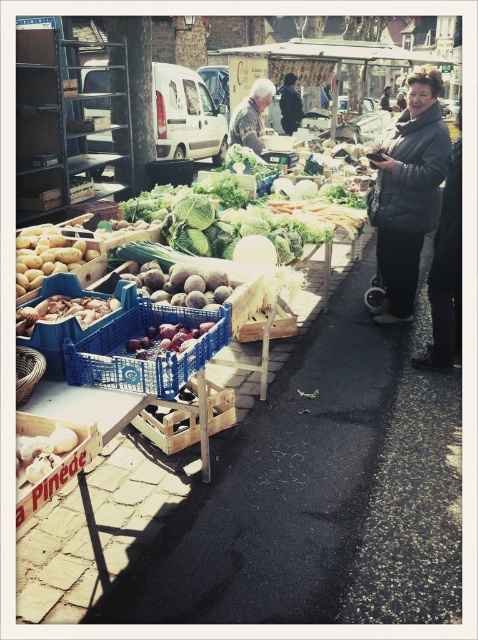
You are a customer at the market and want to find the shortest dark gray clothing item. Which one between the dark gray textured coat at right and the dark gray jacket at center should you look for?

The dark gray textured coat at right has a lesser height compared to the dark gray jacket at center, so you should look for the dark gray textured coat at right.

You are standing at the entrance of the market and want to reach the point marked as point (409, 81). Can you estimate how far you need to walk to get there?

The distance between you and point (409, 81) is 4.53 meters, so you need to walk approximately 4.53 meters to reach it.